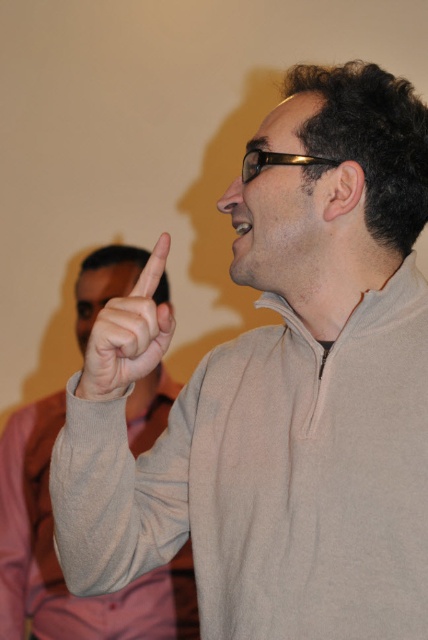
You are an interior designer assessing the spatial arrangement of this room. The gray wool sweater at upper center and the matte gray finger at upper center are both positioned in the same area. Which object takes up more horizontal space in this part of the room?

The gray wool sweater at upper center takes up more horizontal space than the matte gray finger at upper center since its width surpasses the finger.

You are an observer in the scene described. You notice the gray wool sweater at upper center and the matte gray finger at upper center. Which object is positioned more to the right?

The matte gray finger at upper center is positioned more to the right than the gray wool sweater at upper center.